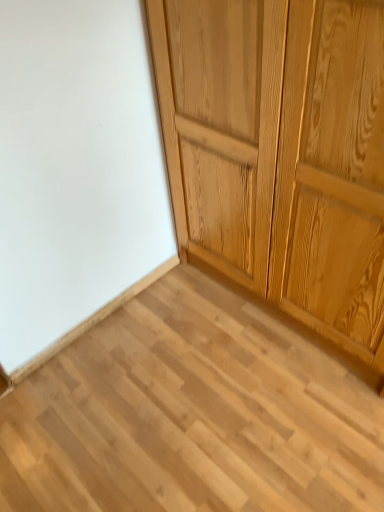
Question: From the image's perspective, is light wood plank at center positioned above or below light brown wood cupboard at upper right?

Choices:
 (A) above
 (B) below

Answer: (B)

Question: Is light wood plank at center taller or shorter than light brown wood cupboard at upper right?

Choices:
 (A) short
 (B) tall

Answer: (A)

Question: Is point (233, 439) closer or farther from the camera than point (291, 208)?

Choices:
 (A) closer
 (B) farther

Answer: (B)

Question: Is light brown wood cupboard at upper right spatially inside light wood plank at center, or outside of it?

Choices:
 (A) outside
 (B) inside

Answer: (A)

Question: Is point (228, 58) positioned closer to the camera than point (317, 497)?

Choices:
 (A) farther
 (B) closer

Answer: (B)

Question: From a real-world perspective, is light brown wood cupboard at upper right physically located above or below light wood plank at center?

Choices:
 (A) above
 (B) below

Answer: (A)

Question: Is light brown wood cupboard at upper right taller or shorter than light wood plank at center?

Choices:
 (A) short
 (B) tall

Answer: (B)